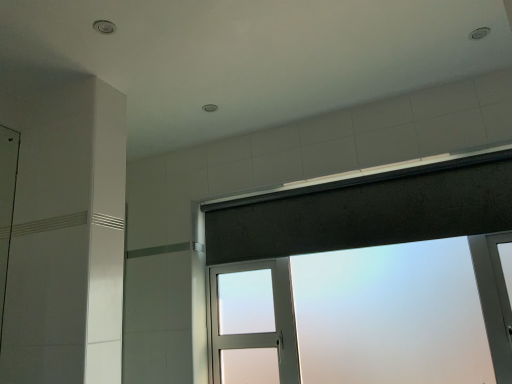
The width and height of the screenshot is (512, 384). What do you see at coordinates (366, 211) in the screenshot?
I see `dark gray fabric at upper center` at bounding box center [366, 211].

Locate an element on the screen. The width and height of the screenshot is (512, 384). dark gray fabric at upper center is located at coordinates (366, 211).

This screenshot has height=384, width=512. I want to click on frosted glass window at upper center, so click(x=271, y=231).

This screenshot has width=512, height=384. What do you see at coordinates (271, 231) in the screenshot?
I see `frosted glass window at upper center` at bounding box center [271, 231].

Identify the location of dark gray fabric at upper center. (x=366, y=211).

Considering the positions of objects dark gray fabric at upper center and frosted glass window at upper center in the image provided, who is more to the left, dark gray fabric at upper center or frosted glass window at upper center?

Positioned to the left is dark gray fabric at upper center.

Is dark gray fabric at upper center in front of or behind frosted glass window at upper center in the image?

Clearly, dark gray fabric at upper center is behind frosted glass window at upper center.

Is point (484, 214) positioned after point (431, 221)?

That is False.

From the image's perspective, is dark gray fabric at upper center located above or below frosted glass window at upper center?

dark gray fabric at upper center is above frosted glass window at upper center.

From a real-world perspective, between dark gray fabric at upper center and frosted glass window at upper center, who is vertically lower?

frosted glass window at upper center is physically lower.

Is dark gray fabric at upper center wider than frosted glass window at upper center?

No, dark gray fabric at upper center is not wider than frosted glass window at upper center.

Who is taller, dark gray fabric at upper center or frosted glass window at upper center?

frosted glass window at upper center.

Which of these two, dark gray fabric at upper center or frosted glass window at upper center, is smaller?

Smaller between the two is dark gray fabric at upper center.

Does dark gray fabric at upper center contain frosted glass window at upper center?

No, frosted glass window at upper center is not inside dark gray fabric at upper center.

Is dark gray fabric at upper center touching frosted glass window at upper center?

Yes, dark gray fabric at upper center and frosted glass window at upper center clearly make contact.

Looking at this image, is dark gray fabric at upper center aimed at frosted glass window at upper center?

No, dark gray fabric at upper center is not turned towards frosted glass window at upper center.

What's the angular difference between dark gray fabric at upper center and frosted glass window at upper center's facing directions?

The facing directions of dark gray fabric at upper center and frosted glass window at upper center are 0.00246 degrees apart.

You are a GUI agent. You are given a task and a screenshot of the screen. Output one action in this format:
    pyautogui.click(x=<x>, y=<y>)
    Task: Click on the shower curtain above the frosted glass window at upper center (from a real-world perspective)
    Image resolution: width=512 pixels, height=384 pixels.
    Given the screenshot: What is the action you would take?
    pyautogui.click(x=366, y=211)

Which is more to the right, frosted glass window at upper center or dark gray fabric at upper center?

Positioned to the right is frosted glass window at upper center.

Between frosted glass window at upper center and dark gray fabric at upper center, which one is positioned in front?

Positioned in front is frosted glass window at upper center.

Does point (286, 222) come closer to viewer compared to point (354, 242)?

No, it is not.

From the image's perspective, between frosted glass window at upper center and dark gray fabric at upper center, who is located below?

frosted glass window at upper center appears lower in the image.

From a real-world perspective, is frosted glass window at upper center physically located above or below dark gray fabric at upper center?

frosted glass window at upper center is below dark gray fabric at upper center.

Is frosted glass window at upper center wider or thinner than dark gray fabric at upper center?

Considering their sizes, frosted glass window at upper center looks broader than dark gray fabric at upper center.

Considering the relative sizes of frosted glass window at upper center and dark gray fabric at upper center in the image provided, is frosted glass window at upper center taller than dark gray fabric at upper center?

Yes.

Is frosted glass window at upper center bigger or smaller than dark gray fabric at upper center?

Clearly, frosted glass window at upper center is larger in size than dark gray fabric at upper center.

Is frosted glass window at upper center surrounding dark gray fabric at upper center?

Indeed, dark gray fabric at upper center is located within frosted glass window at upper center.

Is there a large distance between frosted glass window at upper center and dark gray fabric at upper center?

No, there isn't a large distance between frosted glass window at upper center and dark gray fabric at upper center.

Is frosted glass window at upper center turned away from dark gray fabric at upper center?

Absolutely, frosted glass window at upper center is directed away from dark gray fabric at upper center.

How many degrees apart are the facing directions of frosted glass window at upper center and dark gray fabric at upper center?

The angular difference between frosted glass window at upper center and dark gray fabric at upper center is 0.00246 degrees.

You are a GUI agent. You are given a task and a screenshot of the screen. Output one action in this format:
    pyautogui.click(x=<x>, y=<y>)
    Task: Click on the window located underneath the dark gray fabric at upper center (from a real-world perspective)
    This screenshot has width=512, height=384.
    Given the screenshot: What is the action you would take?
    pyautogui.click(x=271, y=231)

Where is `window on the right side of dark gray fabric at upper center`? window on the right side of dark gray fabric at upper center is located at coordinates 271,231.

Locate an element on the screen. This screenshot has height=384, width=512. window below the dark gray fabric at upper center (from the image's perspective) is located at coordinates (271, 231).